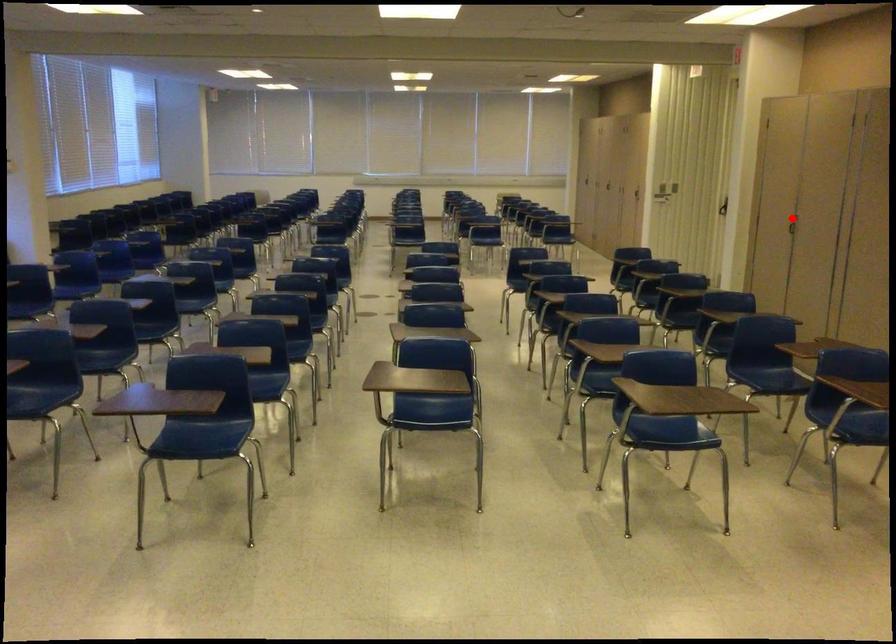
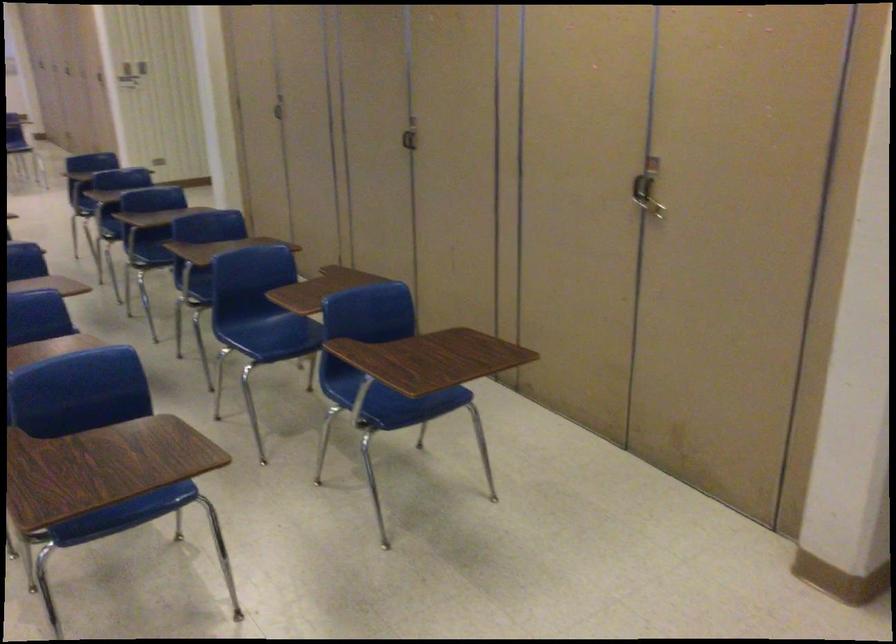
Locate, in the second image, the point that corresponds to the highlighted location in the first image.

(279, 107)